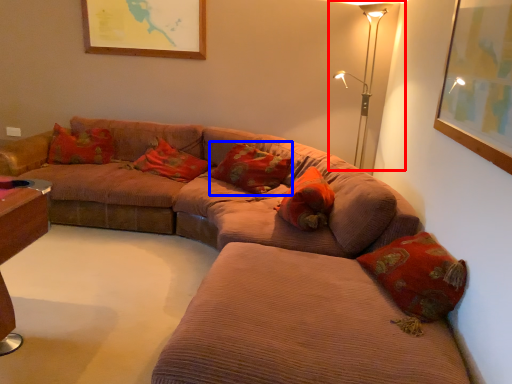
Question: Which point is closer to the camera, table lamp (highlighted by a red box) or pillow (highlighted by a blue box)?

Choices:
 (A) table lamp
 (B) pillow

Answer: (A)